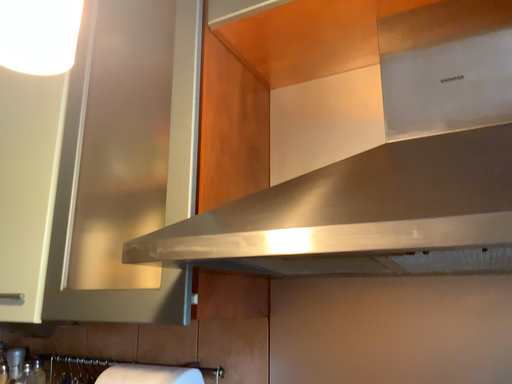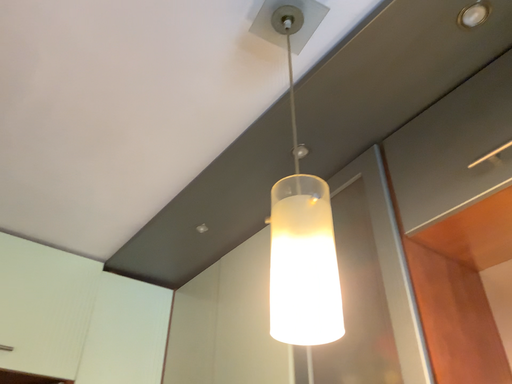
Question: How did the camera likely rotate when shooting the video?

Choices:
 (A) rotated downward
 (B) rotated upward

Answer: (B)